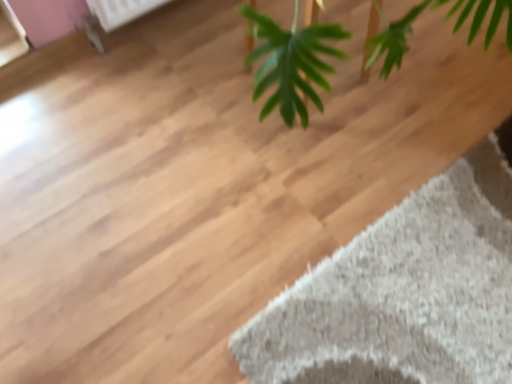
Describe the element at coordinates (403, 293) in the screenshot. I see `white shaggy rug at lower right` at that location.

Measure the distance between point [407,290] and camera.

3.53 feet.

Image resolution: width=512 pixels, height=384 pixels. Find the location of `white shaggy rug at lower right`. white shaggy rug at lower right is located at coordinates (403, 293).

Where is `white shaggy rug at lower right`? This screenshot has height=384, width=512. white shaggy rug at lower right is located at coordinates (403, 293).